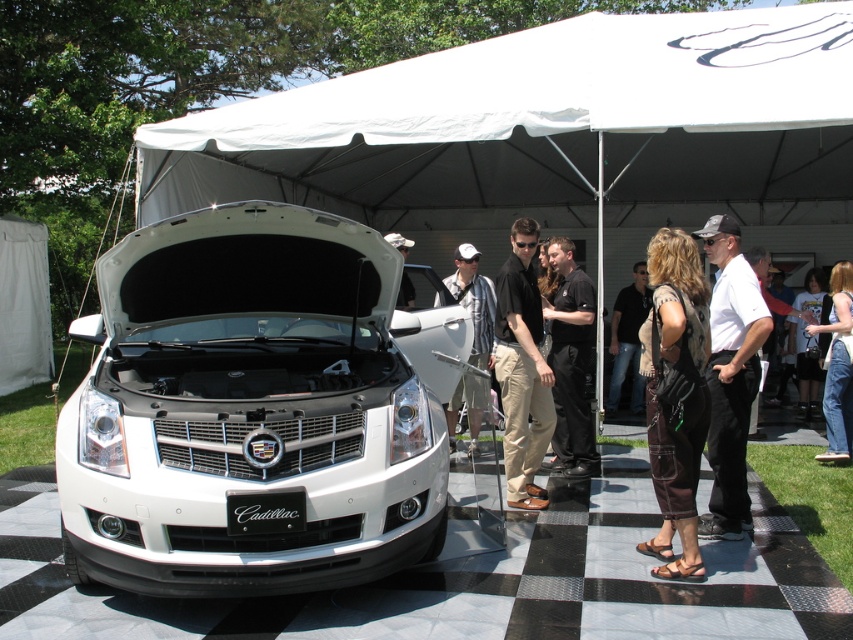
Question: Which point is farther to the camera?

Choices:
 (A) (202, 532)
 (B) (471, 436)

Answer: (B)

Question: Which point is farther from the camera taking this photo?

Choices:
 (A) (682, 536)
 (B) (660, 68)
 (C) (793, 305)

Answer: (C)

Question: Does white matte car at center have a smaller size compared to plaid shirt at center?

Choices:
 (A) yes
 (B) no

Answer: (B)

Question: Observing the image, what is the correct spatial positioning of white fabric tent at center in reference to white matte car at center?

Choices:
 (A) below
 (B) above

Answer: (B)

Question: Considering the real-world distances, which object is closest to the white fabric tent at center?

Choices:
 (A) denim shorts at lower right
 (B) black cotton shirt at center
 (C) plaid shirt at center
 (D) denim jeans at lower right

Answer: (A)

Question: Does white glossy car at center have a greater width compared to black smooth shirt at center?

Choices:
 (A) no
 (B) yes

Answer: (B)